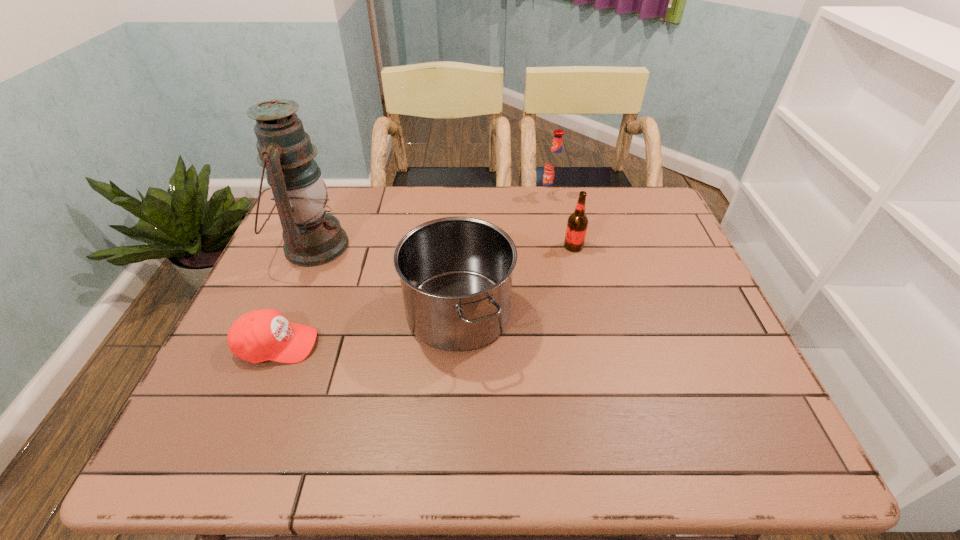
Locate an element on the screen. The height and width of the screenshot is (540, 960). vacant space at the far right corner of the desktop is located at coordinates (626, 209).

Where is `unoccupied position between the tallest object and the saucepan`? The height and width of the screenshot is (540, 960). unoccupied position between the tallest object and the saucepan is located at coordinates pyautogui.click(x=386, y=280).

I want to click on vacant space in between the saucepan and the nearer root beer, so click(516, 280).

You are a GUI agent. You are given a task and a screenshot of the screen. Output one action in this format:
    pyautogui.click(x=<x>, y=<y>)
    Task: Click on the vacant space that is in between the nearer root beer and the farther root beer
    The width and height of the screenshot is (960, 540).
    Given the screenshot: What is the action you would take?
    pyautogui.click(x=563, y=221)

The width and height of the screenshot is (960, 540). I want to click on free area in between the baseball cap and the tallest object, so click(x=295, y=295).

The image size is (960, 540). What are the coordinates of `unoccupied position between the oil lamp and the shortest object` in the screenshot? It's located at (295, 295).

Where is `the fourth closest object to the nearer root beer`? Image resolution: width=960 pixels, height=540 pixels. the fourth closest object to the nearer root beer is located at coordinates (260, 335).

Choose which object is the nearest neighbor to the tallest object. Please provide its 2D coordinates. Your answer should be formatted as a tuple, i.e. [(x, y)], where the tuple contains the x and y coordinates of a point satisfying the conditions above.

[(260, 335)]

In order to click on free spot that satisfies the following two spatial constraints: 1. on the front side of the farthest object; 2. on the front panel of the shortest object in this screenshot , I will do `click(581, 345)`.

This screenshot has width=960, height=540. Identify the location of free spot that satisfies the following two spatial constraints: 1. on the front side of the nearer root beer; 2. on the right side of the taller root beer. (561, 246).